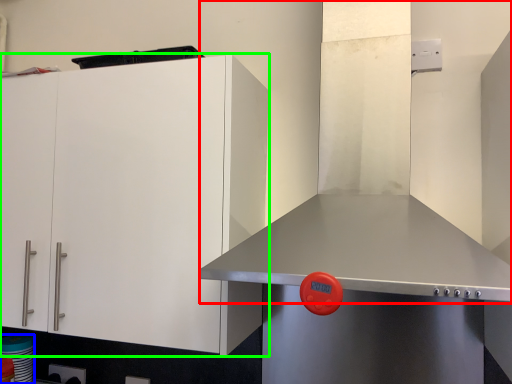
Question: Which object is positioned farthest from exhaust hood (highlighted by a red box)? Select from appliance (highlighted by a blue box) and cabinetry (highlighted by a green box).

Choices:
 (A) appliance
 (B) cabinetry

Answer: (A)